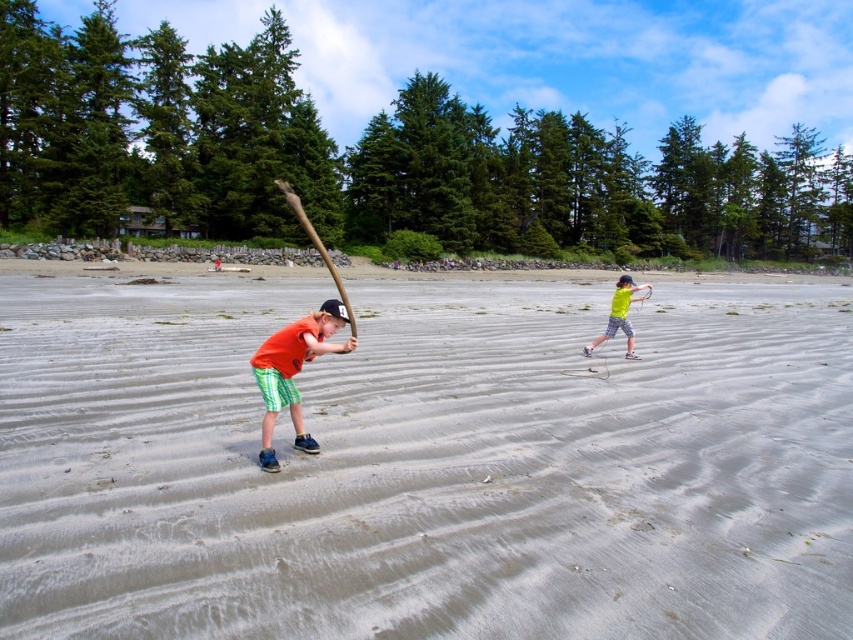
Question: Does smooth sand at center lie behind brown wooden stick at center?

Choices:
 (A) no
 (B) yes

Answer: (A)

Question: Is smooth sand at center closer to camera compared to brown wooden stick at center?

Choices:
 (A) no
 (B) yes

Answer: (B)

Question: Considering the relative positions of neon yellow t-shirt at right and brown wooden stick at center in the image provided, where is neon yellow t-shirt at right located with respect to brown wooden stick at center?

Choices:
 (A) right
 (B) left

Answer: (A)

Question: Considering the real-world distances, which object is farthest from the orange cotton shirt at center?

Choices:
 (A) neon yellow t-shirt at right
 (B) brown wooden stick at center

Answer: (B)

Question: Which point appears farthest from the camera in this image?

Choices:
 (A) (312, 243)
 (B) (596, 346)

Answer: (A)

Question: Which object appears closest to the camera in this image?

Choices:
 (A) brown wooden stick at center
 (B) smooth sand at center
 (C) orange cotton shirt at center

Answer: (B)